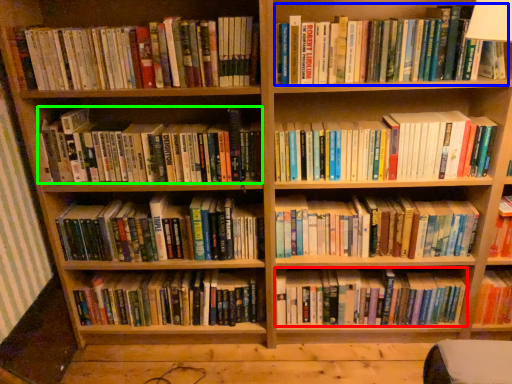
Question: Estimate the real-world distances between objects in this image. Which object is farther from book (highlighted by a red box), book (highlighted by a blue box) or book (highlighted by a green box)?

Choices:
 (A) book
 (B) book

Answer: (A)